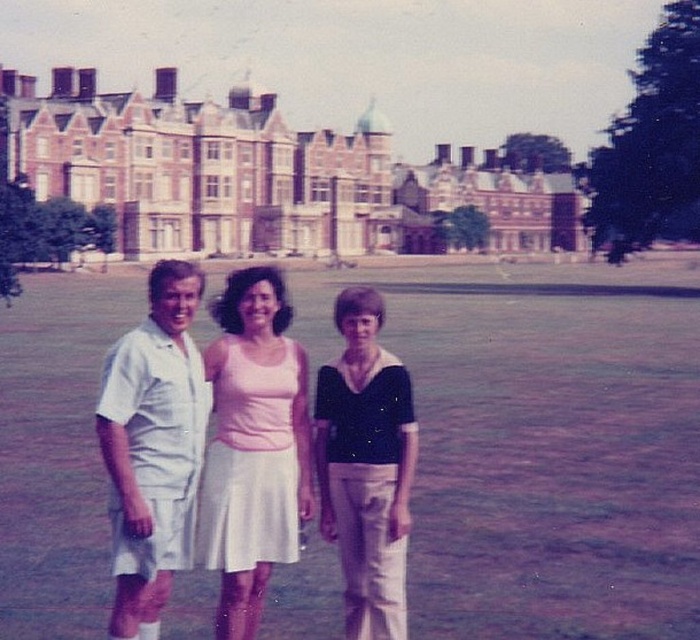
You are a photographer trying to capture a candid shot of the two people in the scene. You notice the pink fabric dress at center and the white cotton shorts at left. Which clothing item should you focus on to ensure both subjects are in the frame?

The pink fabric dress at center is much taller than the white cotton shorts at left, so focusing on the pink fabric dress at center will ensure both subjects are in the frame since it is taller and likely covers more of the scene.

You are standing in the same location as the group of three people in the image. If you want to walk directly towards the brown brick building at upper center, which direction should you move relative to the white cotton shorts at left?

The brown brick building at upper center is to the right of the white cotton shorts at left, so you should move to the right relative to the white cotton shorts at left to walk directly towards it.

From the picture: You are standing in front of the historic mansion and want to take a photo of the pink fabric dress at center. Where should you position yourself to capture the dress in the frame?

To capture the pink fabric dress at center in the frame, position yourself so that the dress is centered at the coordinates approximately 0.697 on the horizontal axis and 0.363 on the vertical axis relative to the image plane.